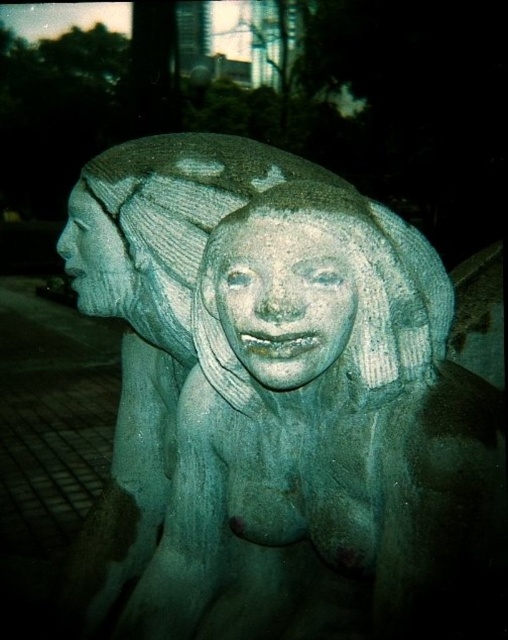
Between green stone statue at center and matte stone face at center, which one appears on the right side from the viewer's perspective?

From the viewer's perspective, green stone statue at center appears more on the right side.

Between point (398, 330) and point (88, 225), which one is positioned in front?

Positioned in front is point (398, 330).

At what (x,y) coordinates should I click in order to perform the action: click on green stone statue at center. Please return your answer as a coordinate pair (x, y). The height and width of the screenshot is (640, 508). Looking at the image, I should click on (282, 410).

Which of these two, green stone statue at center or slate stone face at center, stands taller?

green stone statue at center

Between green stone statue at center and slate stone face at center, which one is positioned higher?

slate stone face at center

In order to click on green stone statue at center in this screenshot , I will do `click(282, 410)`.

Where is `green stone statue at center`? green stone statue at center is located at coordinates (282, 410).

From the picture: Is slate stone face at center wider than matte stone face at center?

Correct, the width of slate stone face at center exceeds that of matte stone face at center.

Does point (238, 305) come farther from viewer compared to point (109, 227)?

No, it is not.

This screenshot has width=508, height=640. In order to click on slate stone face at center in this screenshot , I will do `click(281, 298)`.